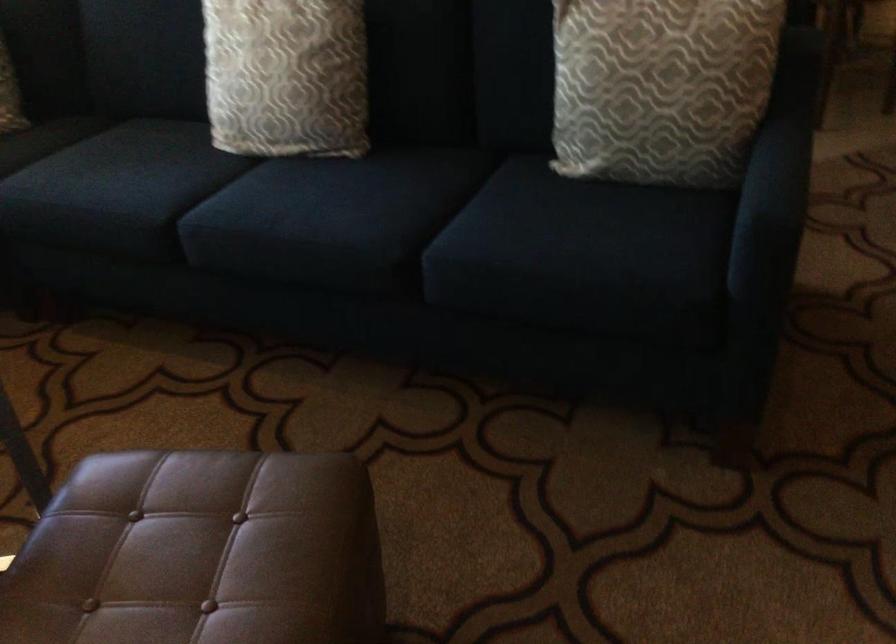
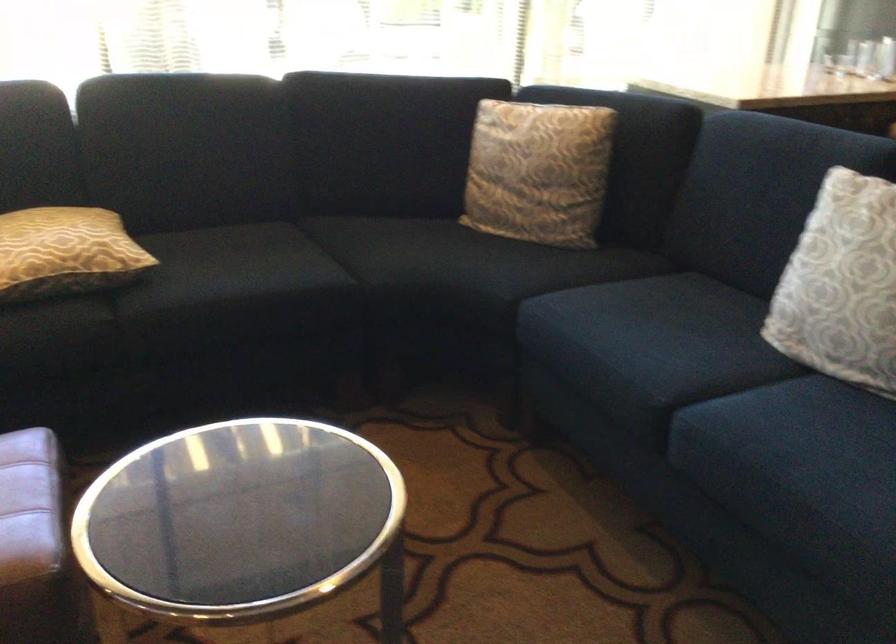
Question: The first image is from the beginning of the video and the second image is from the end. How did the camera likely rotate when shooting the video?

Choices:
 (A) Left
 (B) Right
 (C) Up
 (D) Down

Answer: (A)